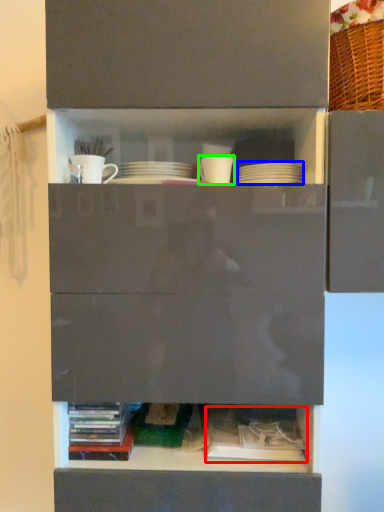
Question: Which object is positioned farthest from book (highlighted by a red box)? Select from tableware (highlighted by a blue box) and tableware (highlighted by a green box).

Choices:
 (A) tableware
 (B) tableware

Answer: (B)